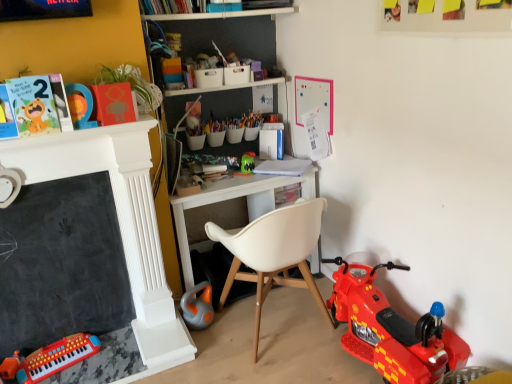
Find the location of a particular element. This screenshot has width=512, height=384. free space that is to the left of white paper at center, the first book in the right-to-left sequence is located at coordinates (249, 177).